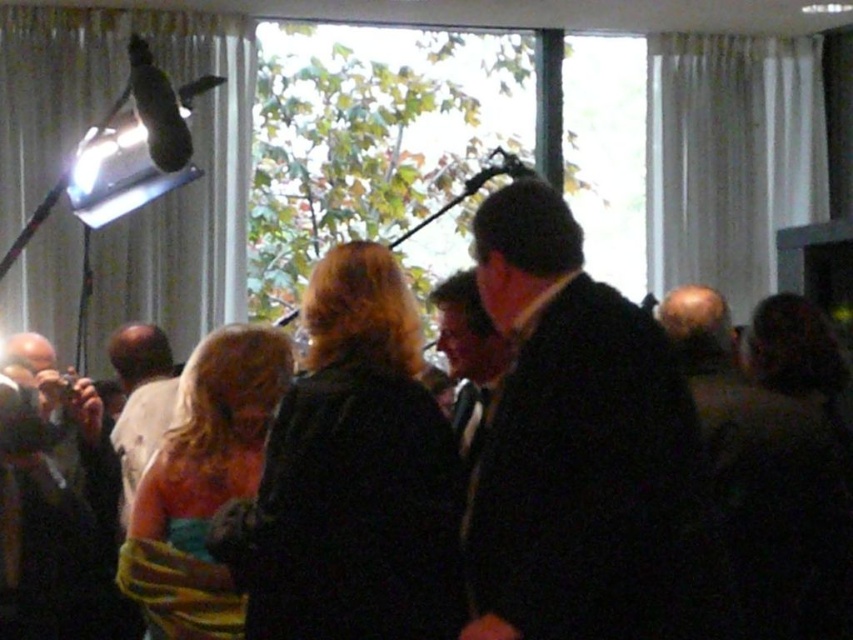
Is point (563, 259) behind point (129, 353)?

No, (563, 259) is closer to viewer.

Can you confirm if black wool coat at center is smaller than light brown hair at center?

Yes, black wool coat at center is smaller than light brown hair at center.

You are a GUI agent. You are given a task and a screenshot of the screen. Output one action in this format:
    pyautogui.click(x=<x>, y=<y>)
    Task: Click on the black wool coat at center
    The image size is (853, 640).
    Given the screenshot: What is the action you would take?
    pyautogui.click(x=573, y=444)

Is black wool coat at center shorter than dark brown leather jacket at lower left?

Correct, black wool coat at center is not as tall as dark brown leather jacket at lower left.

Is point (552, 413) more distant than point (74, 404)?

No, (552, 413) is in front of (74, 404).

The image size is (853, 640). What are the coordinates of `black wool coat at center` in the screenshot? It's located at (573, 444).

Can you confirm if dark brown leather jacket at lower left is wider than light brown hair at center?

Indeed, dark brown leather jacket at lower left has a greater width compared to light brown hair at center.

Find the location of a particular element. dark brown leather jacket at lower left is located at coordinates (55, 506).